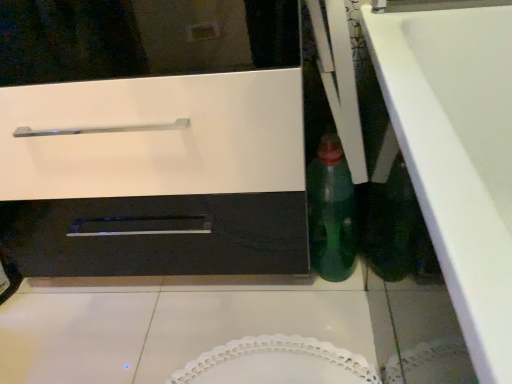
Question: From the image's perspective, is white glossy counter top at lower right above or below green glass bottle at center-right?

Choices:
 (A) above
 (B) below

Answer: (B)

Question: Considering the relative positions of white glossy counter top at lower right and green glass bottle at center-right in the image provided, is white glossy counter top at lower right to the left or to the right of green glass bottle at center-right?

Choices:
 (A) right
 (B) left

Answer: (A)

Question: Which object is the closest to the white glossy oven at center?

Choices:
 (A) green glass bottle at center-right
 (B) white glossy counter top at lower right

Answer: (A)

Question: Which is nearer to the green glass bottle at center-right?

Choices:
 (A) white glossy oven at center
 (B) white glossy counter top at lower right

Answer: (A)